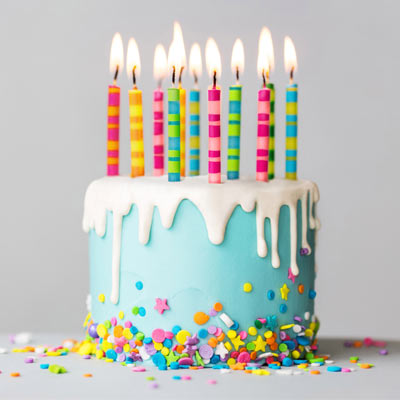
Find the location of a particular element. This screenshot has height=400, width=400. candles with light blue is located at coordinates (171, 128), (196, 133), (238, 137), (289, 140).